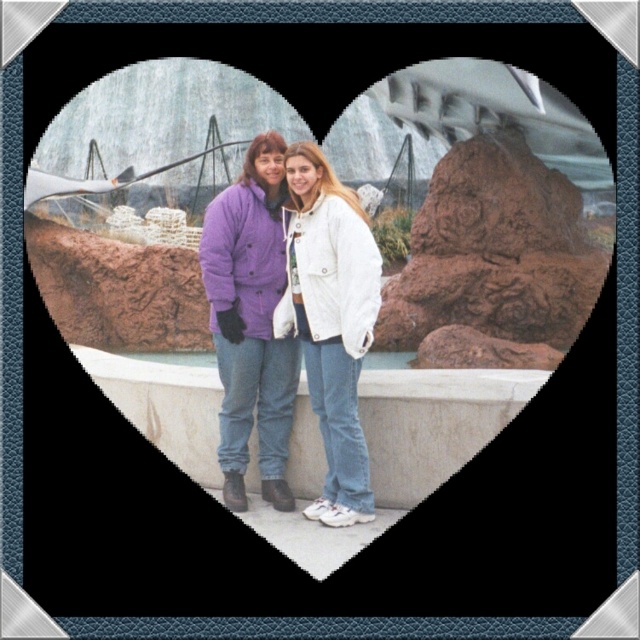
Measure the distance from purple cotton jacket at center to white concrete ledge at center.

purple cotton jacket at center and white concrete ledge at center are 8.49 feet apart.

Can you confirm if purple cotton jacket at center is smaller than white concrete ledge at center?

Yes, purple cotton jacket at center is smaller than white concrete ledge at center.

Consider the image. Who is more distant from viewer, (x=278, y=268) or (x=305, y=403)?

The point (x=278, y=268) is more distant.

At what (x,y) coordinates should I click in order to perform the action: click on purple cotton jacket at center. Please return your answer as a coordinate pair (x, y). Looking at the image, I should click on (257, 307).